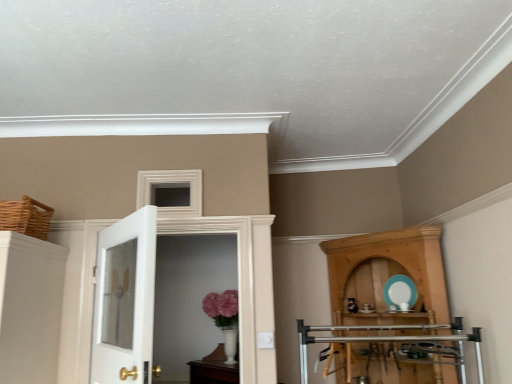
Where is `white glossy door at center, placed as the 2th door when sorted from front to back`? The height and width of the screenshot is (384, 512). white glossy door at center, placed as the 2th door when sorted from front to back is located at coordinates point(244,283).

What do you see at coordinates (26, 217) in the screenshot? I see `woven brown basket at upper left` at bounding box center [26, 217].

Find the location of a particular element. Image resolution: width=512 pixels, height=384 pixels. white glossy door at center, acting as the 1th door starting from the back is located at coordinates (244, 283).

Is woven brown basket at upper left not within white glass door at left, the 1th door from the front?

Yes, woven brown basket at upper left is located beyond the bounds of white glass door at left, the 1th door from the front.

From the picture: From a real-world perspective, is woven brown basket at upper left beneath white glass door at left, arranged as the 2th door when viewed from the back?

Incorrect, from a real-world perspective, woven brown basket at upper left is higher than white glass door at left, arranged as the 2th door when viewed from the back.

Considering the sizes of objects woven brown basket at upper left and white glass door at left, the 1th door from the front, in the image provided, who is taller, woven brown basket at upper left or white glass door at left, the 1th door from the front,?

Standing taller between the two is white glass door at left, the 1th door from the front.

Is wooden cupboard at right to the right of white glossy door at center, placed as the 2th door when sorted from front to back, from the viewer's perspective?

Correct, you'll find wooden cupboard at right to the right of white glossy door at center, placed as the 2th door when sorted from front to back.

Can you confirm if wooden cupboard at right is wider than white glossy door at center, acting as the 1th door starting from the back?

Yes.

From a real-world perspective, is wooden cupboard at right positioned above or below white glossy door at center, placed as the 2th door when sorted from front to back?

In terms of real-world spatial position, wooden cupboard at right is below white glossy door at center, placed as the 2th door when sorted from front to back.

Is white glossy door at center, placed as the 2th door when sorted from front to back, completely or partially outside of wooden cupboard at right?

Indeed, white glossy door at center, placed as the 2th door when sorted from front to back, is completely outside wooden cupboard at right.

Between white glossy door at center, acting as the 1th door starting from the back, and wooden cupboard at right, which one has smaller width?

Thinner between the two is white glossy door at center, acting as the 1th door starting from the back.

Does white glossy door at center, acting as the 1th door starting from the back, have a smaller size compared to wooden cupboard at right?

Indeed, white glossy door at center, acting as the 1th door starting from the back, has a smaller size compared to wooden cupboard at right.

Is white glass door at left, arranged as the 2th door when viewed from the back, far away from wooden cupboard at right?

Yes.

From a real-world perspective, is white glass door at left, arranged as the 2th door when viewed from the back, positioned above or below wooden cupboard at right?

Clearly, from a real-world perspective, white glass door at left, arranged as the 2th door when viewed from the back, is above wooden cupboard at right.

From the image's perspective, is white glass door at left, the 1th door from the front, over wooden cupboard at right?

Yes, from the image's perspective, white glass door at left, the 1th door from the front, is over wooden cupboard at right.

Does white glass door at left, arranged as the 2th door when viewed from the back, turn towards wooden cupboard at right?

Yes, white glass door at left, arranged as the 2th door when viewed from the back, faces towards wooden cupboard at right.

From the picture: Are white glossy door at center, placed as the 2th door when sorted from front to back, and white glass door at left, the 1th door from the front, beside each other?

No, white glossy door at center, placed as the 2th door when sorted from front to back, is not next to white glass door at left, the 1th door from the front.

Would you say white glass door at left, arranged as the 2th door when viewed from the back, is part of white glossy door at center, acting as the 1th door starting from the back,'s contents?

That's incorrect, white glass door at left, arranged as the 2th door when viewed from the back, is not inside white glossy door at center, acting as the 1th door starting from the back.

Image resolution: width=512 pixels, height=384 pixels. In order to click on door above the white glass door at left, the 1th door from the front (from a real-world perspective) in this screenshot , I will do 244,283.

Can you confirm if white glossy door at center, placed as the 2th door when sorted from front to back, is shorter than white glass door at left, the 1th door from the front?

Incorrect, the height of white glossy door at center, placed as the 2th door when sorted from front to back, does not fall short of that of white glass door at left, the 1th door from the front.

Are woven brown basket at upper left and wooden cupboard at right far apart?

Yes, woven brown basket at upper left and wooden cupboard at right are quite far apart.

From a real-world perspective, who is located lower, woven brown basket at upper left or wooden cupboard at right?

wooden cupboard at right.

How far apart are woven brown basket at upper left and wooden cupboard at right?

2.09 meters.

Looking at the image, does woven brown basket at upper left seem bigger or smaller compared to wooden cupboard at right?

Considering their sizes, woven brown basket at upper left takes up less space than wooden cupboard at right.

Based on the photo, from a real-world perspective, does wooden cupboard at right sit lower than white glass door at left, the 1th door from the front?

Yes.

From the image's perspective, who appears lower, wooden cupboard at right or white glass door at left, the 1th door from the front?

From the image's view, wooden cupboard at right is below.

Is wooden cupboard at right positioned with its back to white glass door at left, arranged as the 2th door when viewed from the back?

No, wooden cupboard at right's orientation is not away from white glass door at left, arranged as the 2th door when viewed from the back.

The height and width of the screenshot is (384, 512). Find the location of `basket above the white glass door at left, the 1th door from the front (from a real-world perspective)`. basket above the white glass door at left, the 1th door from the front (from a real-world perspective) is located at coordinates (26, 217).

The width and height of the screenshot is (512, 384). I want to click on cupboard located behind the white glossy door at center, placed as the 2th door when sorted from front to back, so click(388, 274).

Considering their positions, is wooden cupboard at right positioned closer to white glossy door at center, placed as the 2th door when sorted from front to back, than white glass door at left, the 1th door from the front?

white glass door at left, the 1th door from the front, lies closer to white glossy door at center, placed as the 2th door when sorted from front to back, than the other object.

Looking at the image, which one is located closer to white glass door at left, arranged as the 2th door when viewed from the back, wooden cupboard at right or white glossy door at center, placed as the 2th door when sorted from front to back?

white glossy door at center, placed as the 2th door when sorted from front to back, is positioned closer to the anchor white glass door at left, arranged as the 2th door when viewed from the back.

Estimate the real-world distances between objects in this image. Which object is further from white glass door at left, the 1th door from the front, wooden cupboard at right or woven brown basket at upper left?

Among the two, wooden cupboard at right is located further to white glass door at left, the 1th door from the front.

From the image, which object appears to be farther from white glass door at left, the 1th door from the front, woven brown basket at upper left or wooden cupboard at right?

Based on the image, wooden cupboard at right appears to be further to white glass door at left, the 1th door from the front.

Looking at the image, which one is located further to white glass door at left, arranged as the 2th door when viewed from the back, white glossy door at center, acting as the 1th door starting from the back, or wooden cupboard at right?

wooden cupboard at right is positioned further to the anchor white glass door at left, arranged as the 2th door when viewed from the back.

Based on their spatial positions, is white glass door at left, arranged as the 2th door when viewed from the back, or wooden cupboard at right closer to woven brown basket at upper left?

white glass door at left, arranged as the 2th door when viewed from the back, is closer to woven brown basket at upper left.

Based on their spatial positions, is white glass door at left, the 1th door from the front, or woven brown basket at upper left further from white glossy door at center, acting as the 1th door starting from the back?

woven brown basket at upper left is positioned further to the anchor white glossy door at center, acting as the 1th door starting from the back.

From the image, which object appears to be farther from wooden cupboard at right, woven brown basket at upper left or white glass door at left, arranged as the 2th door when viewed from the back?

The object further to wooden cupboard at right is woven brown basket at upper left.

Where is `door between woven brown basket at upper left and white glossy door at center, placed as the 2th door when sorted from front to back, in the horizontal direction`? door between woven brown basket at upper left and white glossy door at center, placed as the 2th door when sorted from front to back, in the horizontal direction is located at coordinates (125, 300).

At what (x,y) coordinates should I click in order to perform the action: click on door located between white glass door at left, the 1th door from the front, and wooden cupboard at right in the left-right direction. Please return your answer as a coordinate pair (x, y). The width and height of the screenshot is (512, 384). Looking at the image, I should click on (244, 283).